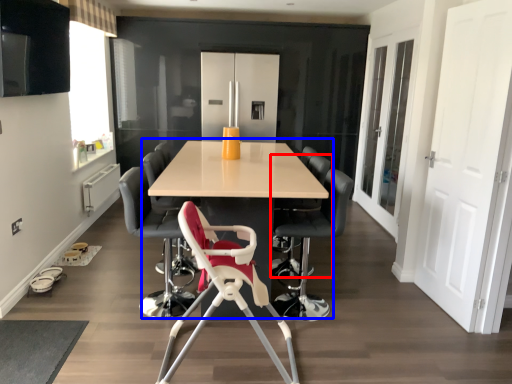
Question: Which object is closer to the camera taking this photo, chair (highlighted by a red box) or table (highlighted by a blue box)?

Choices:
 (A) chair
 (B) table

Answer: (B)